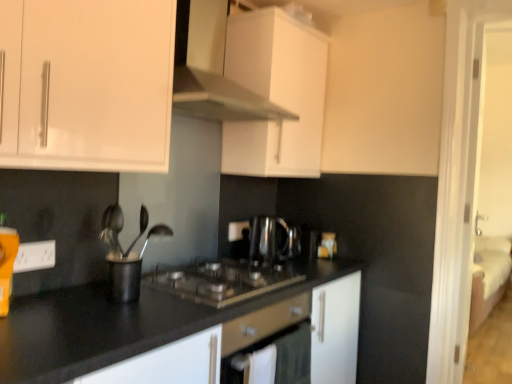
Question: From a real-world perspective, is white glossy cabinet at upper center, positioned as the second cabinetry in front-to-back order, above or below white matte cabinet at upper center, which is the third cabinetry from front to back?

Choices:
 (A) below
 (B) above

Answer: (B)

Question: Is point tap(227, 89) positioned closer to the camera than point tap(303, 81)?

Choices:
 (A) farther
 (B) closer

Answer: (B)

Question: Which of these objects is positioned farthest from the white glossy cabinet at upper center, positioned as the second cabinetry in front-to-back order?

Choices:
 (A) black granite countertop at center
 (B) satin black coffee machine at center
 (C) white matte cabinet at upper center, which is the third cabinetry from front to back
 (D) polished metal spoon at center
 (E) black matte utensil holder at center

Answer: (A)

Question: Which is farther from the black granite countertop at center?

Choices:
 (A) white glossy cabinet at upper left, placed as the first cabinetry when sorted from front to back
 (B) satin black coffee machine at center
 (C) white plastic electrical outlet at lower left
 (D) white glossy cabinet at upper center, the 2th cabinetry in the back-to-front sequence
 (E) black stainless steel gas stove at center

Answer: (D)